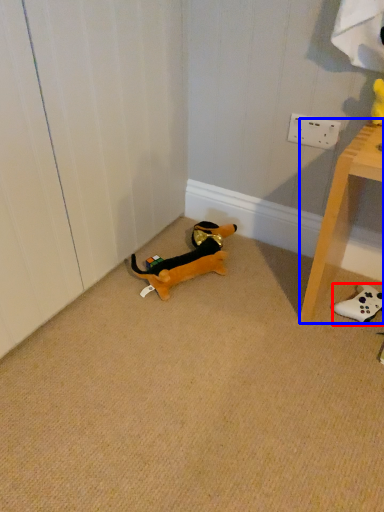
Question: Which object appears farthest to the camera in this image, toy (highlighted by a red box) or furniture (highlighted by a blue box)?

Choices:
 (A) toy
 (B) furniture

Answer: (A)